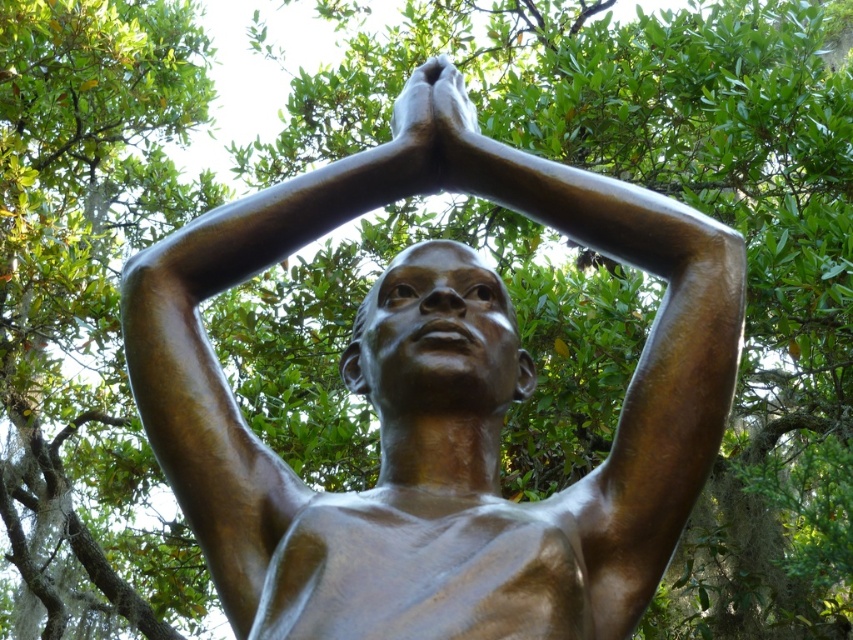
Question: Is bronze statue at center thinner than bronze/metallic muscle at center?

Choices:
 (A) no
 (B) yes

Answer: (A)

Question: Which of the following is the farthest from the observer?

Choices:
 (A) (389, 428)
 (B) (451, 124)
 (C) (502, 557)

Answer: (B)

Question: Which object appears farthest from the camera in this image?

Choices:
 (A) bronze at center
 (B) bronze/metallic muscle at center
 (C) bronze statue at center

Answer: (A)

Question: In this image, where is bronze statue at center located relative to bronze at center?

Choices:
 (A) above
 (B) below

Answer: (B)

Question: Is bronze/metallic muscle at center to the right of bronze at center from the viewer's perspective?

Choices:
 (A) no
 (B) yes

Answer: (A)

Question: Which object is the closest to the bronze/metallic muscle at center?

Choices:
 (A) bronze at center
 (B) bronze statue at center

Answer: (B)